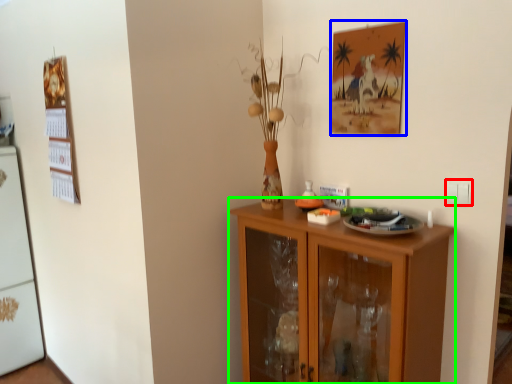
Question: Which is farther away from electric outlet (highlighted by a red box)? picture frame (highlighted by a blue box) or cabinetry (highlighted by a green box)?

Choices:
 (A) picture frame
 (B) cabinetry

Answer: (B)